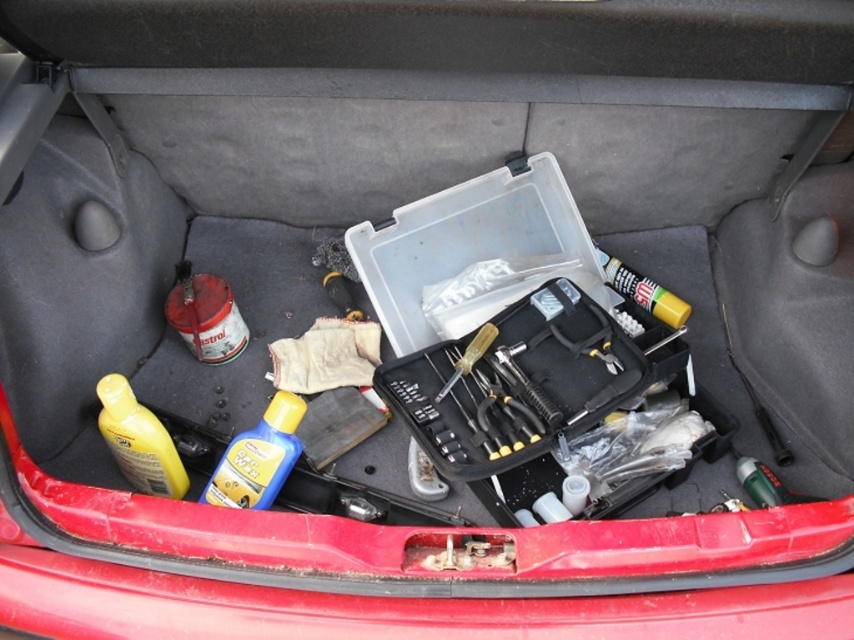
You are organizing the trunk of the red vehicle and need to place the yellow matte glue stick at center and the metallic screwdriver at center into a drawer that can only hold items up to 10 cm in width. Based on their widths, can both items fit side by side in the drawer?

The yellow matte glue stick at center is wider than the metallic screwdriver at center. Since the drawer can only hold items up to 10 cm in width, we need to know the exact widths of both items to determine if they can fit together. However, the provided information does not specify their exact widths, only that the glue stick is wider. Without knowing the exact measurements, it is uncertain if their combined width would exceed the 10 cm limit.

Is the white plastic container at point (138, 440) located to the left or right of the black tool box?

The white plastic container at point (138, 440) is located to the left of the black tool box.

You are organizing items in the trunk of a red vehicle. You have a yellow glossy bottle at lower left and a yellow matte glue stick at center. Which item is taller?

The yellow glossy bottle at lower left is taller than the yellow matte glue stick at center.